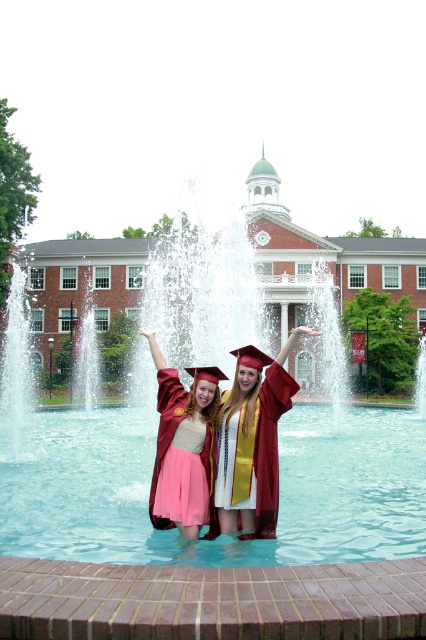
Question: Which of the following is the closest to the observer?

Choices:
 (A) (198, 451)
 (B) (290, 525)
 (C) (227, 509)
 (D) (322, 486)

Answer: (C)

Question: Which of these objects is positioned farthest from the maroon satin gown at center?

Choices:
 (A) clear glass water at center
 (B) matte pink skirt at center

Answer: (A)

Question: Is clear blue water at center to the right of maroon satin gown at center from the viewer's perspective?

Choices:
 (A) no
 (B) yes

Answer: (A)

Question: Does maroon satin gown at center have a greater width compared to matte pink skirt at center?

Choices:
 (A) yes
 (B) no

Answer: (B)

Question: Estimate the real-world distances between objects in this image. Which object is farther from the clear blue water at center?

Choices:
 (A) matte pink skirt at center
 (B) clear glass water at center

Answer: (A)

Question: Can you confirm if clear glass water at center is wider than maroon satin gown at center?

Choices:
 (A) yes
 (B) no

Answer: (A)